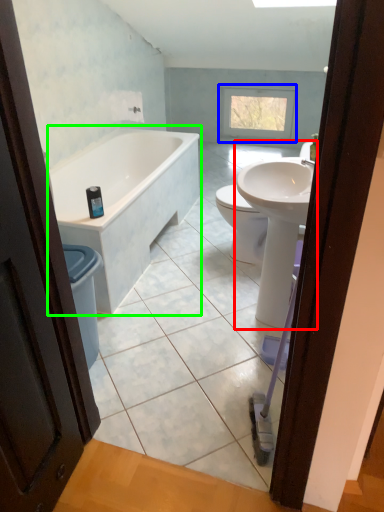
Question: Which is nearer to the sink (highlighted by a red box)? window (highlighted by a blue box) or bathtub (highlighted by a green box).

Choices:
 (A) window
 (B) bathtub

Answer: (B)